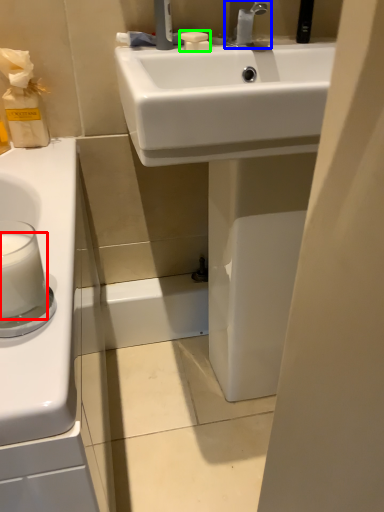
Question: Considering the real-world distances, which object is closest to milk (highlighted by a red box)? tap (highlighted by a blue box) or soap (highlighted by a green box).

Choices:
 (A) tap
 (B) soap

Answer: (B)